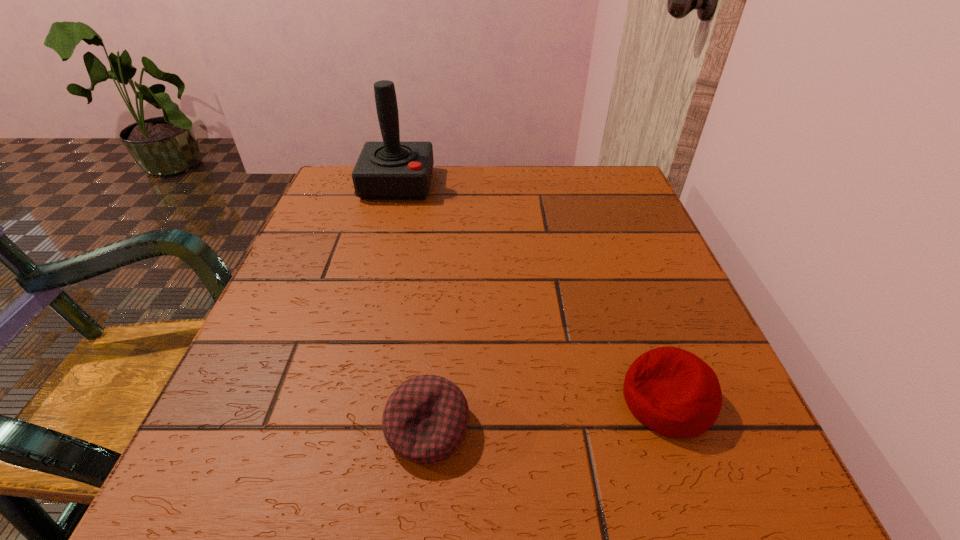
Identify the location of object identified as the second closest to the rightmost object. (390, 170).

Identify which object is located as the nearest to the tallest object. Please provide its 2D coordinates. Your answer should be formatted as a tuple, i.e. [(x, y)], where the tuple contains the x and y coordinates of a point satisfying the conditions above.

[(425, 419)]

Image resolution: width=960 pixels, height=540 pixels. I want to click on free space that satisfies the following two spatial constraints: 1. on the base of the left beanbag; 2. on the right side of the joystick, so click(331, 428).

The image size is (960, 540). Find the location of `free region that satisfies the following two spatial constraints: 1. on the base of the joystick; 2. on the left side of the left beanbag`. free region that satisfies the following two spatial constraints: 1. on the base of the joystick; 2. on the left side of the left beanbag is located at coordinates (331, 428).

Where is `vacant area in the image that satisfies the following two spatial constraints: 1. on the base of the tallest object; 2. on the right side of the left beanbag`? The width and height of the screenshot is (960, 540). vacant area in the image that satisfies the following two spatial constraints: 1. on the base of the tallest object; 2. on the right side of the left beanbag is located at coordinates (331, 428).

Image resolution: width=960 pixels, height=540 pixels. Identify the location of vacant region that satisfies the following two spatial constraints: 1. on the seat area of the right beanbag; 2. on the front side of the left beanbag. (678, 428).

Where is `vacant space that satisfies the following two spatial constraints: 1. on the seat area of the rightmost object; 2. on the front side of the left beanbag`? vacant space that satisfies the following two spatial constraints: 1. on the seat area of the rightmost object; 2. on the front side of the left beanbag is located at coordinates (678, 428).